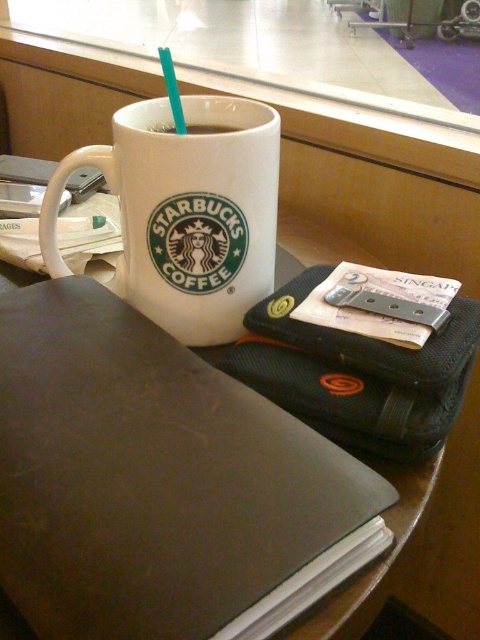
Question: Does leather-like brown binder at center-left have a smaller size compared to white glossy mug at upper center?

Choices:
 (A) yes
 (B) no

Answer: (B)

Question: Is teal plastic straw at upper center above white glossy mug at upper center?

Choices:
 (A) no
 (B) yes

Answer: (B)

Question: Among these objects, which one is nearest to the camera?

Choices:
 (A) white matte starbucks coffee cup at upper center
 (B) leather-like brown binder at center-left
 (C) white glossy mug at upper center
 (D) teal plastic straw at upper center

Answer: (B)

Question: Is leather-like brown binder at center-left behind teal plastic straw at upper center?

Choices:
 (A) yes
 (B) no

Answer: (B)

Question: Estimate the real-world distances between objects in this image. Which object is closer to the white matte starbucks coffee cup at upper center?

Choices:
 (A) teal plastic straw at upper center
 (B) leather-like brown binder at center-left
 (C) white glossy mug at upper center

Answer: (C)

Question: Which point is farther to the camera?

Choices:
 (A) (171, 129)
 (B) (171, 104)
 (C) (223, 268)

Answer: (A)